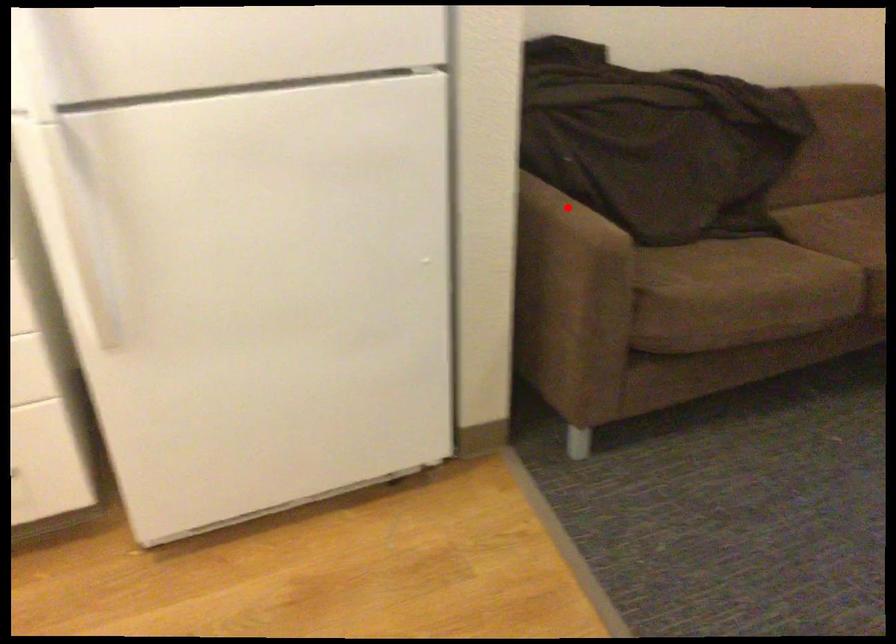
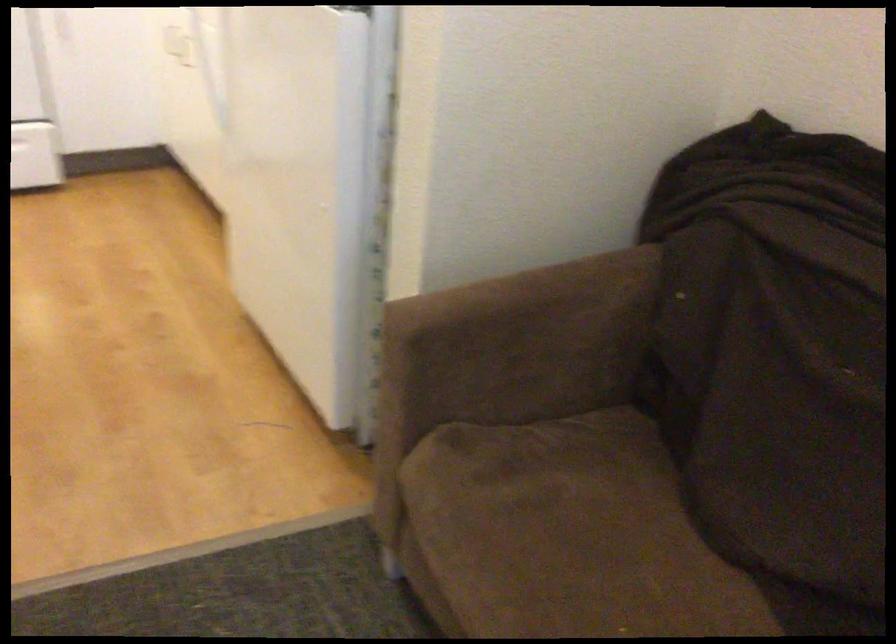
Find the pixel in the second image that matches the highlighted location in the first image.

(533, 310)